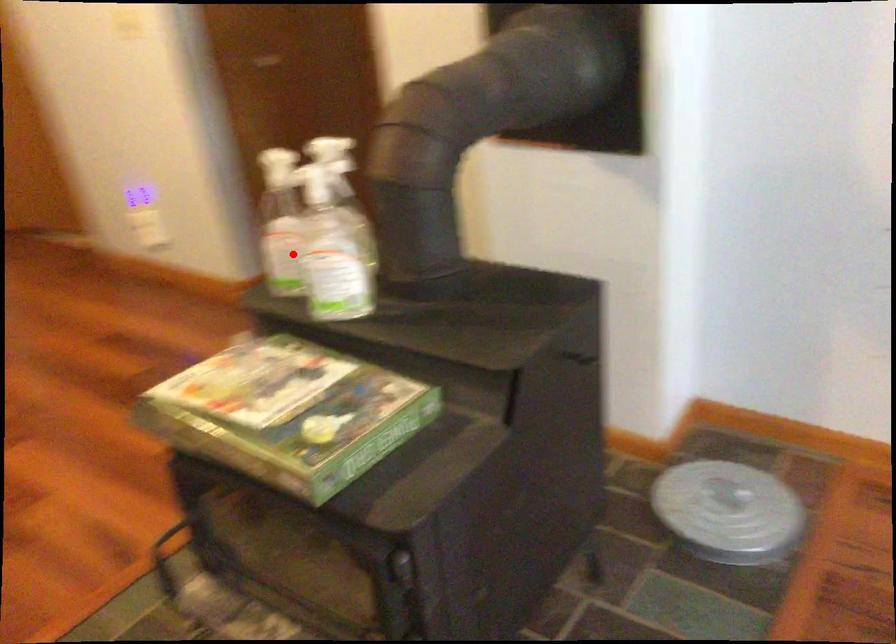
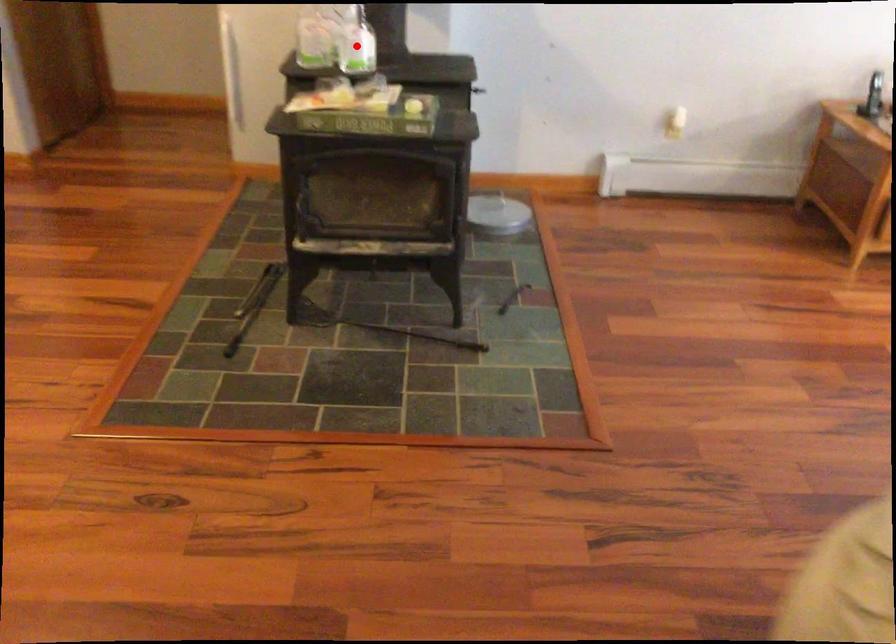
In the scene shown: I am providing you with two images of the same scene from different viewpoints. A red point is marked on the first image and another point is marked on the second image. Is the red point in image1 aligned with the point shown in image2?

No